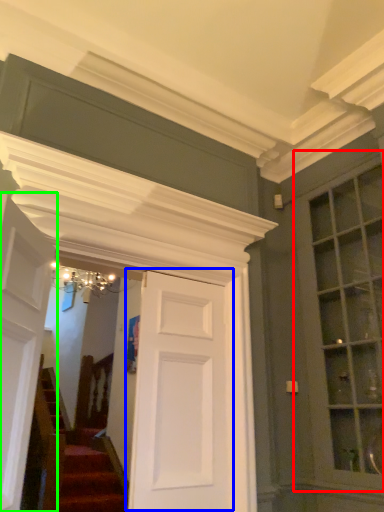
Question: Which object is positioned closest to window (highlighted by a red box)? Select from door (highlighted by a blue box) and door (highlighted by a green box).

Choices:
 (A) door
 (B) door

Answer: (A)